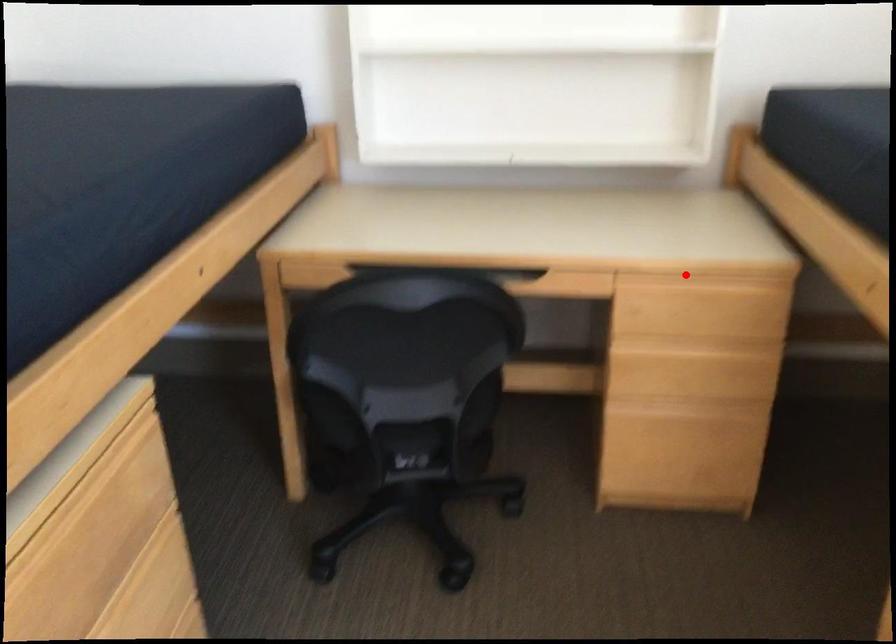
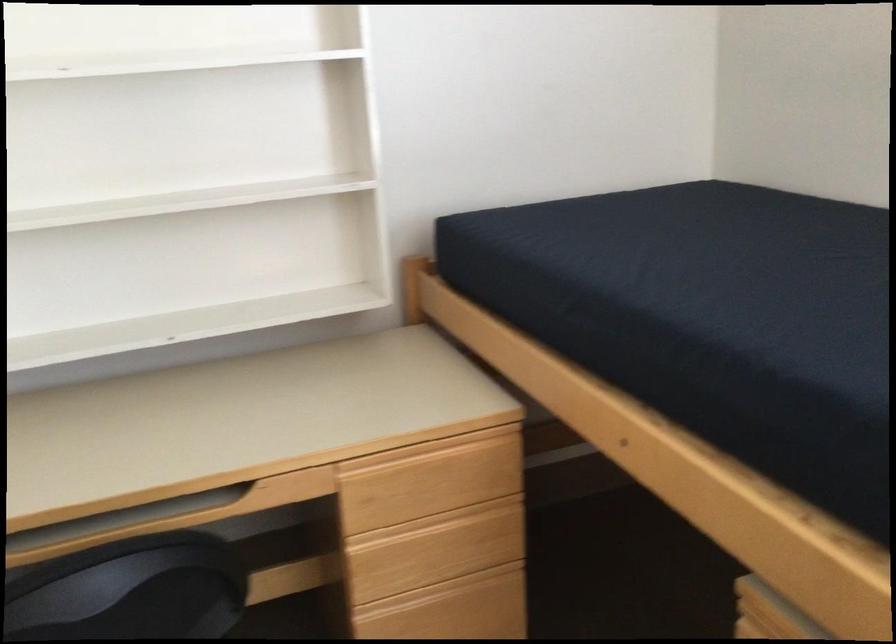
Question: A red point is marked in image1. In image2, is the corresponding 3D point closer to the camera or farther? Reply with the corresponding letter.

Choices:
 (A) The corresponding 3D point is closer.
 (B) The corresponding 3D point is farther.

Answer: (A)